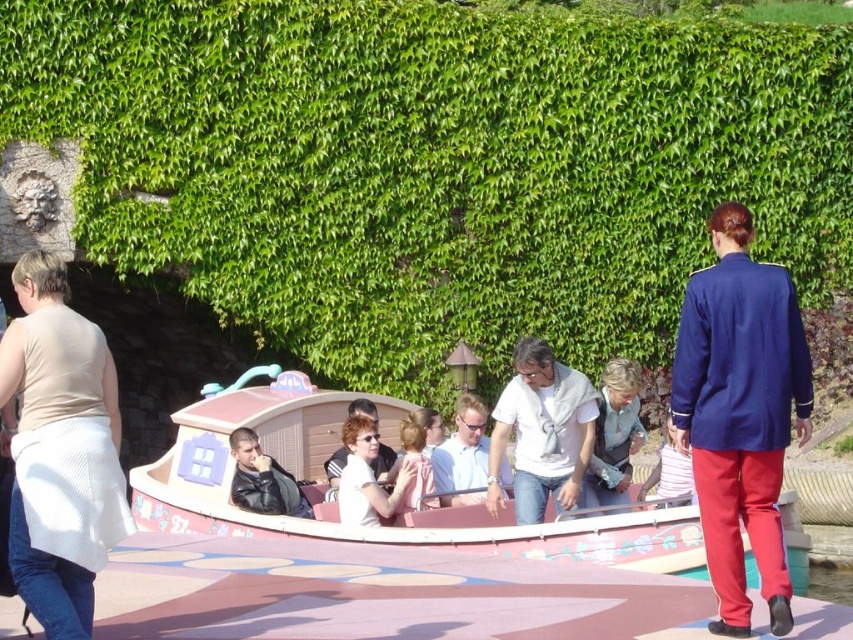
Who is positioned more to the left, white cotton shirt at center or white shirt at center?

Positioned to the left is white shirt at center.

Is point (663, 486) less distant than point (387, 470)?

Yes, it is.

The width and height of the screenshot is (853, 640). Identify the location of white cotton shirt at center. (670, 474).

Who is taller, light blue denim jeans at center or light blue shirt at center?

light blue denim jeans at center

In the scene shown: Can you confirm if light blue denim jeans at center is positioned below light blue shirt at center?

No.

This screenshot has width=853, height=640. What do you see at coordinates (614, 435) in the screenshot?
I see `light blue denim jeans at center` at bounding box center [614, 435].

This screenshot has width=853, height=640. Identify the location of light blue denim jeans at center. (614, 435).

Identify the location of beige fabric skirt at lower left. (61, 451).

Between point (47, 380) and point (379, 486), which one is positioned behind?

The point (379, 486) is more distant.

This screenshot has height=640, width=853. What are the coordinates of `beige fabric skirt at lower left` in the screenshot? It's located at [61, 451].

The width and height of the screenshot is (853, 640). I want to click on beige fabric skirt at lower left, so click(x=61, y=451).